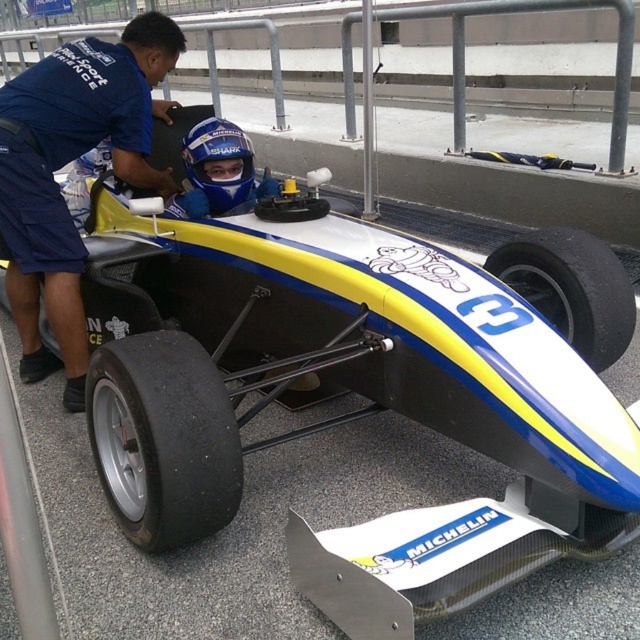
Question: Can you confirm if black rubber tire at lower center is positioned to the left of blue matte helmet at center?

Choices:
 (A) no
 (B) yes

Answer: (A)

Question: Which point is closer to the camera taking this photo?

Choices:
 (A) (51, 166)
 (B) (202, 148)
 (C) (166, 445)

Answer: (C)

Question: Which object is the closest to the blue fabric shirt at left?

Choices:
 (A) blue matte helmet at center
 (B) black rubber tire at lower center

Answer: (A)

Question: Which object appears closest to the camera in this image?

Choices:
 (A) blue fabric shirt at left
 (B) black rubber tire at lower left
 (C) black rubber tire at lower center
 (D) blue matte helmet at center

Answer: (B)

Question: Where is blue fabric shirt at left located in relation to blue matte helmet at center in the image?

Choices:
 (A) left
 (B) right

Answer: (A)

Question: Is blue fabric shirt at left smaller than blue matte helmet at center?

Choices:
 (A) yes
 (B) no

Answer: (B)